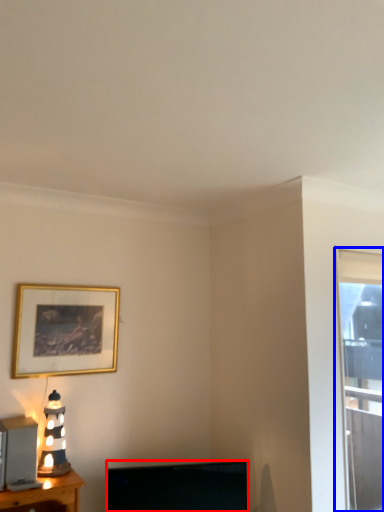
Question: Among these objects, which one is nearest to the camera, television (highlighted by a red box) or window (highlighted by a blue box)?

Choices:
 (A) television
 (B) window

Answer: (A)